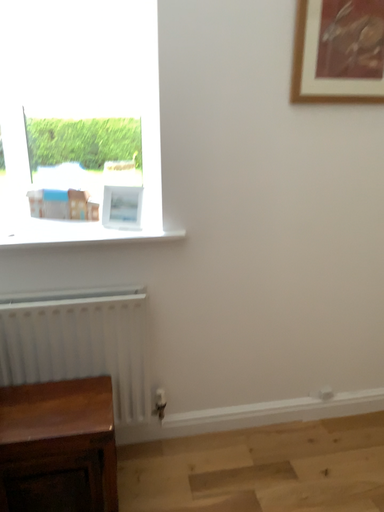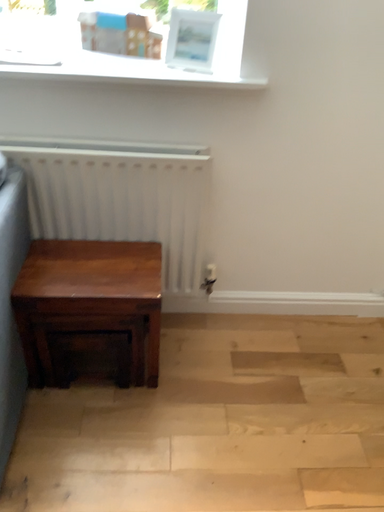
Question: How did the camera likely rotate when shooting the video?

Choices:
 (A) rotated upward
 (B) rotated downward

Answer: (B)